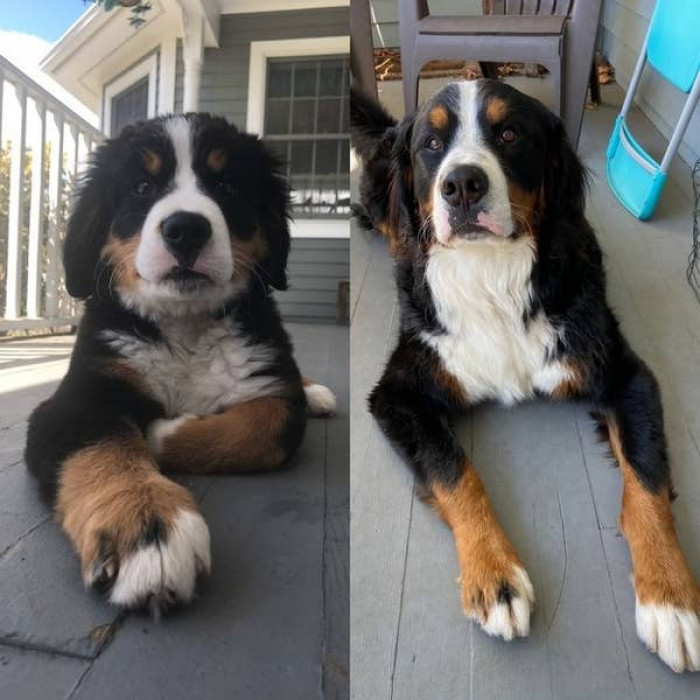
Image resolution: width=700 pixels, height=700 pixels. Identify the location of plastic chair. (526, 38).